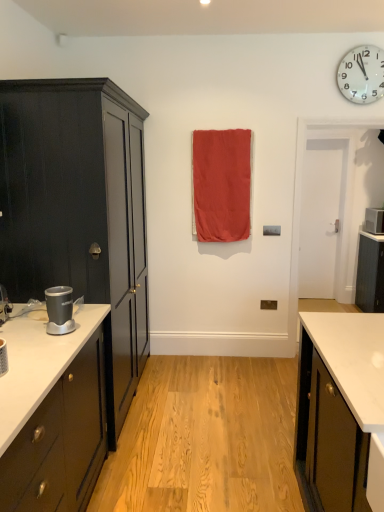
Measure the distance between point (376, 245) and camera.

The depth of point (376, 245) is 4.43 meters.

This screenshot has height=512, width=384. I want to click on black matte cabinet at right, which appears as the 1th cabinetry when viewed from the right, so click(x=370, y=274).

Is matte red fabric at center inside silver metallic blender at left, which appears as the first appliance when viewed from the left?

No, matte red fabric at center is not a part of silver metallic blender at left, which appears as the first appliance when viewed from the left.

Who is more distant, silver metallic blender at left, which appears as the first appliance when viewed from the left, or matte red fabric at center?

matte red fabric at center is more distant.

Could you tell me if silver metallic blender at left, which is the second appliance in back-to-front order, is facing matte red fabric at center?

No.

From a real-world perspective, which object stands above the other?

matte red fabric at center is physically above.

Looking at their sizes, would you say white plastic wall clock at upper right is wider or thinner than white plastic microwave at right, which appears as the first appliance when viewed from the top?

white plastic wall clock at upper right is thinner than white plastic microwave at right, which appears as the first appliance when viewed from the top.

Is white plastic wall clock at upper right aimed at white plastic microwave at right, which appears as the first appliance when viewed from the top?

No.

Consider the image. Is white plastic wall clock at upper right far from white plastic microwave at right, which appears as the first appliance when viewed from the top?

white plastic wall clock at upper right is far away from white plastic microwave at right, which appears as the first appliance when viewed from the top.

From the image's perspective, is white plastic wall clock at upper right located above or below white plastic microwave at right, which appears as the first appliance when viewed from the top?

From the image's perspective, white plastic wall clock at upper right appears above white plastic microwave at right, which appears as the first appliance when viewed from the top.

Considering the sizes of objects matte black cabinet at left, which appears as the second cabinetry when viewed from the right, and matte red fabric at center in the image provided, who is thinner, matte black cabinet at left, which appears as the second cabinetry when viewed from the right, or matte red fabric at center?

matte red fabric at center.

Is matte black cabinet at left, which appears as the second cabinetry when viewed from the right, taller than matte red fabric at center?

Correct, matte black cabinet at left, which appears as the second cabinetry when viewed from the right, is much taller as matte red fabric at center.

Which object is positioned more to the left, matte black cabinet at left, which appears as the second cabinetry when viewed from the right, or matte red fabric at center?

matte black cabinet at left, which appears as the second cabinetry when viewed from the right.

Considering the sizes of white plastic wall clock at upper right and silver metallic blender at left, which is the second appliance in back-to-front order, in the image, is white plastic wall clock at upper right wider or thinner than silver metallic blender at left, which is the second appliance in back-to-front order,?

Clearly, white plastic wall clock at upper right has less width compared to silver metallic blender at left, which is the second appliance in back-to-front order.

Considering the positions of point (370, 54) and point (53, 319), is point (370, 54) closer or farther from the camera than point (53, 319)?

Point (370, 54) is positioned farther from the camera compared to point (53, 319).

Find the location of a particular element. This screenshot has width=384, height=512. wall clock above the silver metallic blender at left, which is the first appliance in bottom-to-top order (from a real-world perspective) is located at coordinates (362, 74).

Does point (214, 161) appear closer or farther from the camera than point (378, 263)?

Point (214, 161) is closer to the camera than point (378, 263).

From a real-world perspective, is matte red fabric at center physically located above or below black matte cabinet at right, which is counted as the 2th cabinetry, starting from the front?

matte red fabric at center is above black matte cabinet at right, which is counted as the 2th cabinetry, starting from the front.

Who is taller, matte red fabric at center or black matte cabinet at right, which is counted as the first cabinetry, starting from the back?

matte red fabric at center.

From the image's perspective, is matte red fabric at center above or below black matte cabinet at right, which appears as the 1th cabinetry when viewed from the right?

From the image's perspective, matte red fabric at center appears above black matte cabinet at right, which appears as the 1th cabinetry when viewed from the right.

Which point is more forward, (365,221) or (351,95)?

The point (351,95) is in front.

Is white plastic wall clock at upper right surrounded by white plastic microwave at right, the 2th appliance from the bottom?

Definitely not — white plastic wall clock at upper right is not inside white plastic microwave at right, the 2th appliance from the bottom.

Is silver metallic blender at left, which appears as the first appliance when viewed from the left, to the right of white plastic wall clock at upper right from the viewer's perspective?

Incorrect, silver metallic blender at left, which appears as the first appliance when viewed from the left, is not on the right side of white plastic wall clock at upper right.

Identify the location of appliance lying on the left of white plastic wall clock at upper right. (59, 310).

Which of these two, silver metallic blender at left, which appears as the first appliance when viewed from the left, or white plastic wall clock at upper right, is smaller?

silver metallic blender at left, which appears as the first appliance when viewed from the left.

Where is `appliance in front of the matte red fabric at center`? The width and height of the screenshot is (384, 512). appliance in front of the matte red fabric at center is located at coordinates (59, 310).

Locate an element on the screen. the 1st appliance positioned below the white plastic wall clock at upper right (from a real-world perspective) is located at coordinates (374, 220).

Looking at the image, which one is located closer to matte red fabric at center, matte black cabinet at left, positioned as the 1th cabinetry in front-to-back order, or white plastic wall clock at upper right?

white plastic wall clock at upper right.

When comparing their distances from white plastic microwave at right, placed as the second appliance when sorted from left to right, does matte black cabinet at left, which ranks as the first cabinetry in left-to-right order, or silver metallic blender at left, which appears as the first appliance when viewed from the left, seem further?

silver metallic blender at left, which appears as the first appliance when viewed from the left, is positioned further to the anchor white plastic microwave at right, placed as the second appliance when sorted from left to right.

When comparing their distances from matte black cabinet at left, positioned as the 1th cabinetry in front-to-back order, does white plastic microwave at right, arranged as the 1th appliance when viewed from the back, or white plastic wall clock at upper right seem further?

white plastic microwave at right, arranged as the 1th appliance when viewed from the back, lies further to matte black cabinet at left, positioned as the 1th cabinetry in front-to-back order, than the other object.

Considering their positions, is black matte cabinet at right, which is counted as the 2th cabinetry, starting from the front, positioned further to white plastic wall clock at upper right than white plastic microwave at right, placed as the second appliance when sorted from left to right?

The object further to white plastic wall clock at upper right is black matte cabinet at right, which is counted as the 2th cabinetry, starting from the front.

Looking at the image, which one is located closer to black matte cabinet at right, which appears as the second cabinetry when viewed from the left, white plastic microwave at right, the 2th appliance in the front-to-back sequence, or white plastic wall clock at upper right?

Among the two, white plastic microwave at right, the 2th appliance in the front-to-back sequence, is located nearer to black matte cabinet at right, which appears as the second cabinetry when viewed from the left.

Based on their spatial positions, is matte red fabric at center or black matte cabinet at right, which appears as the second cabinetry when viewed from the left, further from white plastic wall clock at upper right?

black matte cabinet at right, which appears as the second cabinetry when viewed from the left, lies further to white plastic wall clock at upper right than the other object.

Estimate the real-world distances between objects in this image. Which object is closer to white plastic microwave at right, the 2th appliance from the bottom, black matte cabinet at right, which appears as the second cabinetry when viewed from the left, or matte red fabric at center?

Among the two, black matte cabinet at right, which appears as the second cabinetry when viewed from the left, is located nearer to white plastic microwave at right, the 2th appliance from the bottom.

When comparing their distances from matte black cabinet at left, which appears as the second cabinetry when viewed from the right, does white plastic microwave at right, the 2th appliance in the front-to-back sequence, or silver metallic blender at left, the first appliance positioned from the front, seem further?

Among the two, white plastic microwave at right, the 2th appliance in the front-to-back sequence, is located further to matte black cabinet at left, which appears as the second cabinetry when viewed from the right.

Where is `wall clock situated between matte red fabric at center and black matte cabinet at right, which appears as the second cabinetry when viewed from the left, from left to right`? wall clock situated between matte red fabric at center and black matte cabinet at right, which appears as the second cabinetry when viewed from the left, from left to right is located at coordinates (362, 74).

Where is `curtain between silver metallic blender at left, which appears as the first appliance when viewed from the left, and white plastic wall clock at upper right`? This screenshot has width=384, height=512. curtain between silver metallic blender at left, which appears as the first appliance when viewed from the left, and white plastic wall clock at upper right is located at coordinates (221, 184).

Identify the location of appliance between silver metallic blender at left, which is counted as the 2th appliance, starting from the right, and black matte cabinet at right, which appears as the 1th cabinetry when viewed from the right. (374, 220).

Locate an element on the screen. curtain located between silver metallic blender at left, which is the second appliance in back-to-front order, and black matte cabinet at right, which appears as the 1th cabinetry when viewed from the right, in the left-right direction is located at coordinates (221, 184).